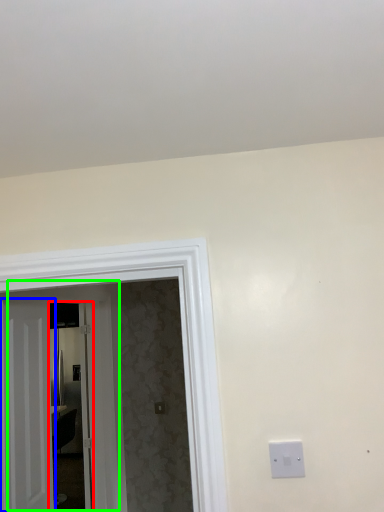
Question: Which is nearer to the glass door (highlighted by a red box)? door (highlighted by a blue box) or door (highlighted by a green box).

Choices:
 (A) door
 (B) door

Answer: (B)